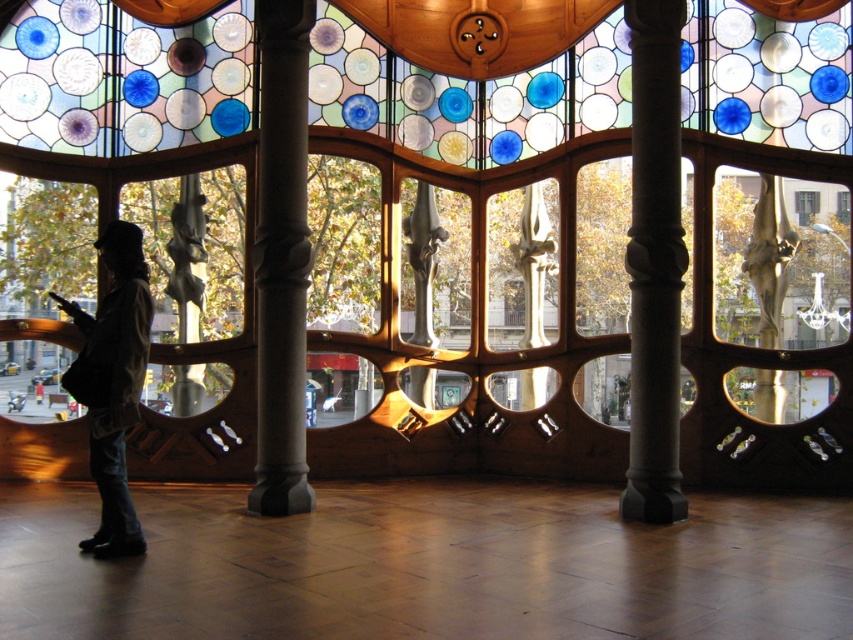
Is camouflage jacket at left to the right of metallic gray sculpture at center from the viewer's perspective?

No, camouflage jacket at left is not to the right of metallic gray sculpture at center.

Which is behind, point (99, 525) or point (415, 196)?

Positioned behind is point (415, 196).

At what (x,y) coordinates should I click in order to perform the action: click on camouflage jacket at left. Please return your answer as a coordinate pair (x, y). The image size is (853, 640). Looking at the image, I should click on (113, 381).

Who is positioned more to the left, camouflage jacket at left or polished bronze statue at center?

camouflage jacket at left is more to the left.

Can you confirm if camouflage jacket at left is positioned to the right of polished bronze statue at center?

Incorrect, camouflage jacket at left is not on the right side of polished bronze statue at center.

The height and width of the screenshot is (640, 853). What do you see at coordinates (113, 381) in the screenshot? I see `camouflage jacket at left` at bounding box center [113, 381].

Where is `camouflage jacket at left`? camouflage jacket at left is located at coordinates (113, 381).

Is point (651, 230) positioned behind point (122, 301)?

That is True.

What do you see at coordinates (654, 262) in the screenshot?
I see `carved stone column at center` at bounding box center [654, 262].

What do you see at coordinates (654, 262) in the screenshot? I see `carved stone column at center` at bounding box center [654, 262].

At what (x,y) coordinates should I click in order to perform the action: click on carved stone column at center. Please return your answer as a coordinate pair (x, y). The height and width of the screenshot is (640, 853). Looking at the image, I should click on (654, 262).